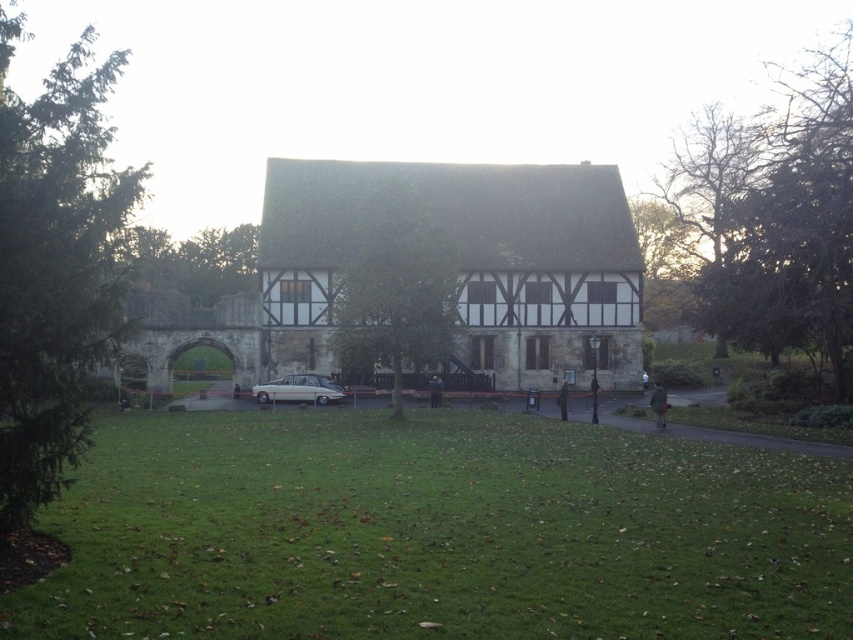
Question: Among these points, which one is farthest from the camera?

Choices:
 (A) (288, 376)
 (B) (433, 385)

Answer: (A)

Question: Does green grass at center come behind dark brown leather jacket at center?

Choices:
 (A) no
 (B) yes

Answer: (A)

Question: Which of the following is the farthest from the observer?

Choices:
 (A) green grass at center
 (B) silver metallic car at center
 (C) dark blue jacket at center

Answer: (B)

Question: Which of these objects is positioned farthest from the dark brown leather jacket at center?

Choices:
 (A) silver metallic car at center
 (B) dark blue jacket at center
 (C) green fabric jacket at center

Answer: (A)

Question: Is green fabric jacket at center bigger than dark blue jacket at center?

Choices:
 (A) yes
 (B) no

Answer: (A)

Question: Is green grass at center to the right of silver metallic car at center from the viewer's perspective?

Choices:
 (A) no
 (B) yes

Answer: (B)